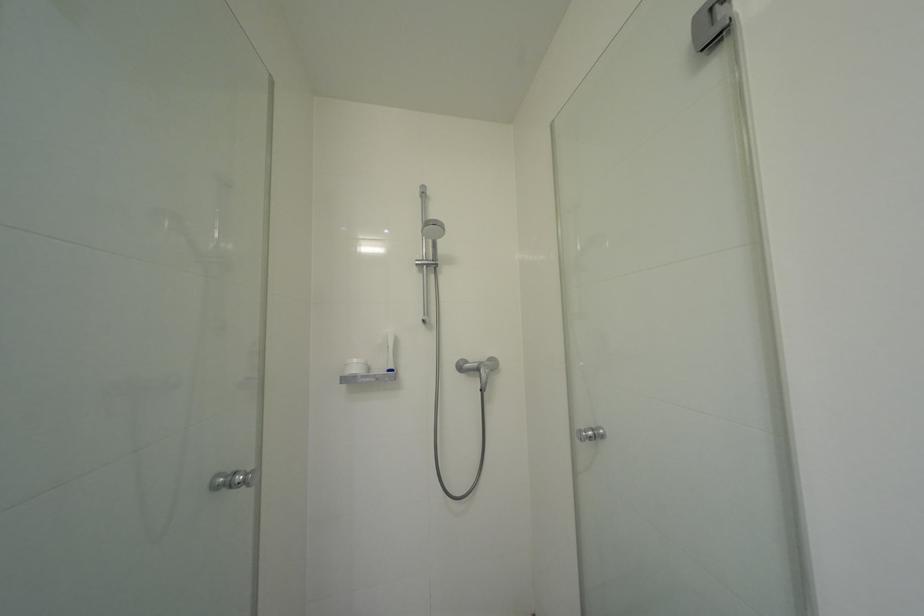
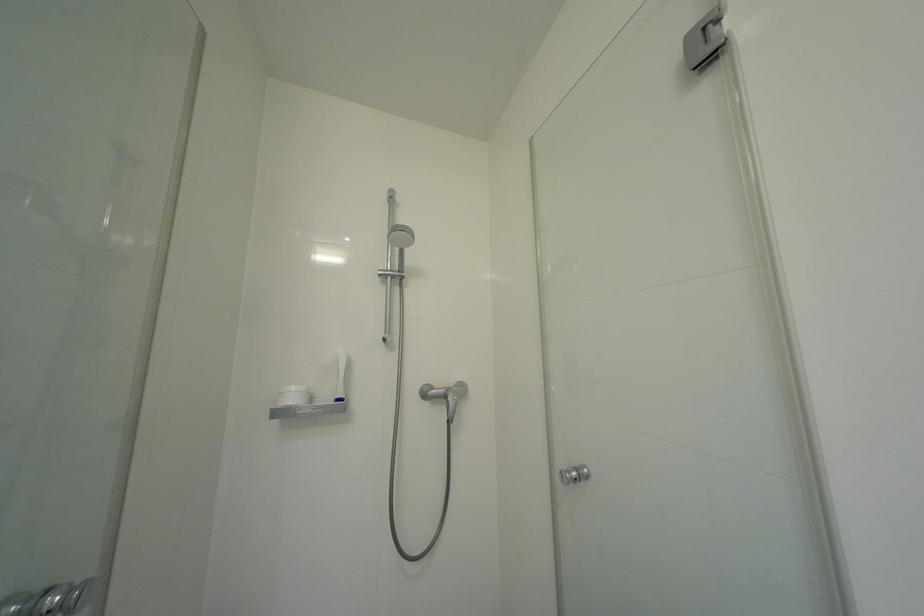
Question: In a continuous first-person perspective shot, in which direction is the camera moving?

Choices:
 (A) Left
 (B) Right
 (C) Forward
 (D) Backward

Answer: (C)